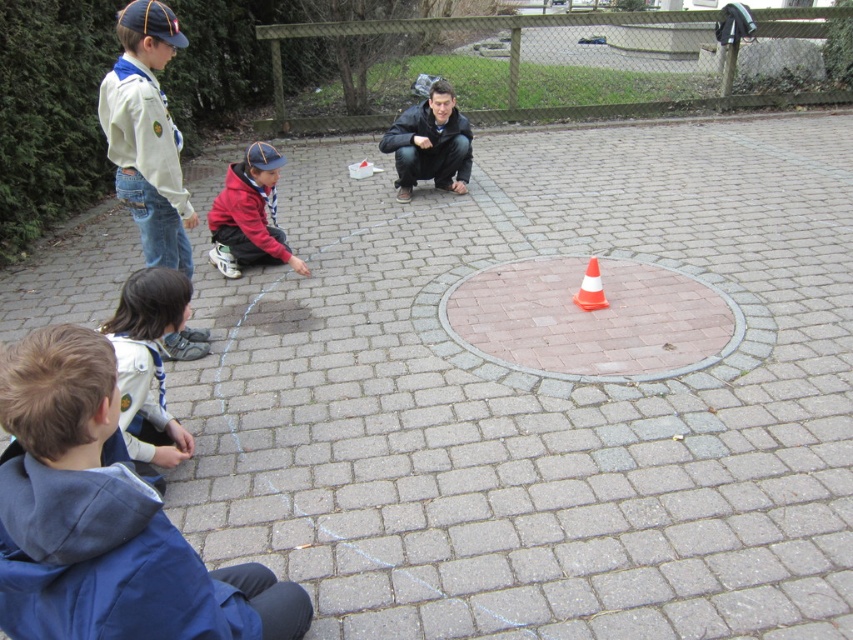
You are a photographer positioned at the edge of the paved area. You need to take a photo that includes both the white matte uniform at upper left and the red fleece jacket at center. Given the distance between them, will you be able to frame both subjects in a single shot without moving your position?

The white matte uniform at upper left is 27.03 inches away from the red fleece jacket at center. Since the distance is relatively short, you can likely frame both subjects in a single shot without moving your position.